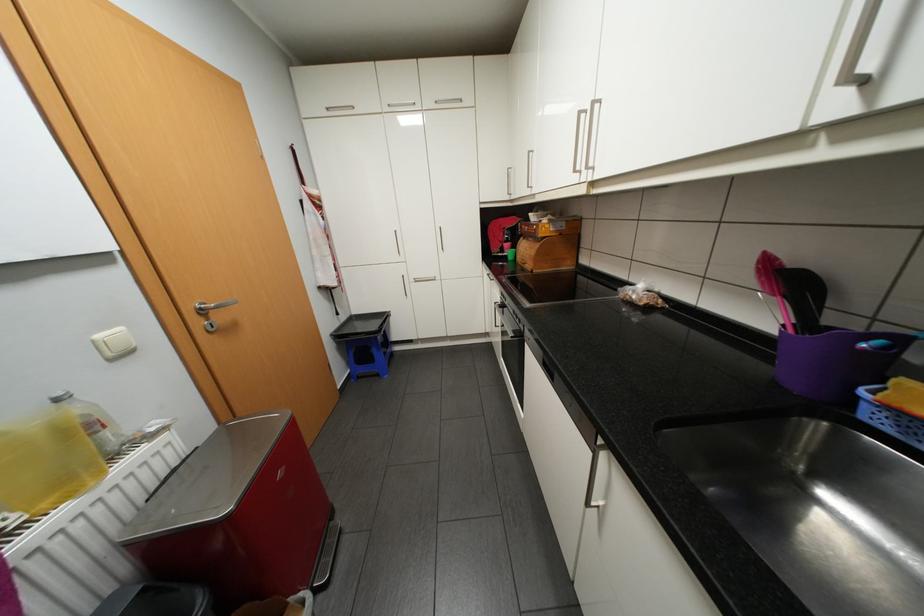
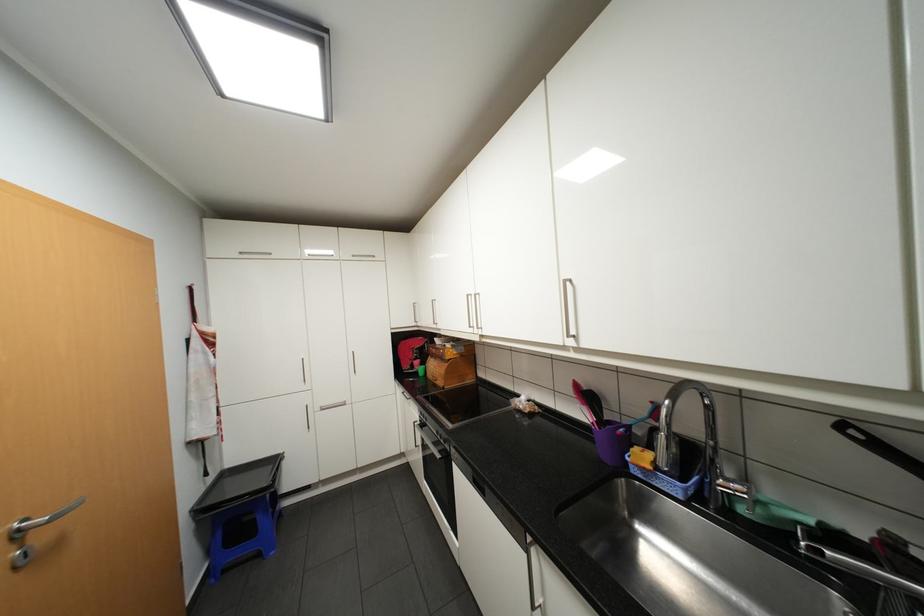
Find the pixel in the second image that matches [588,111] in the first image.

(476, 294)